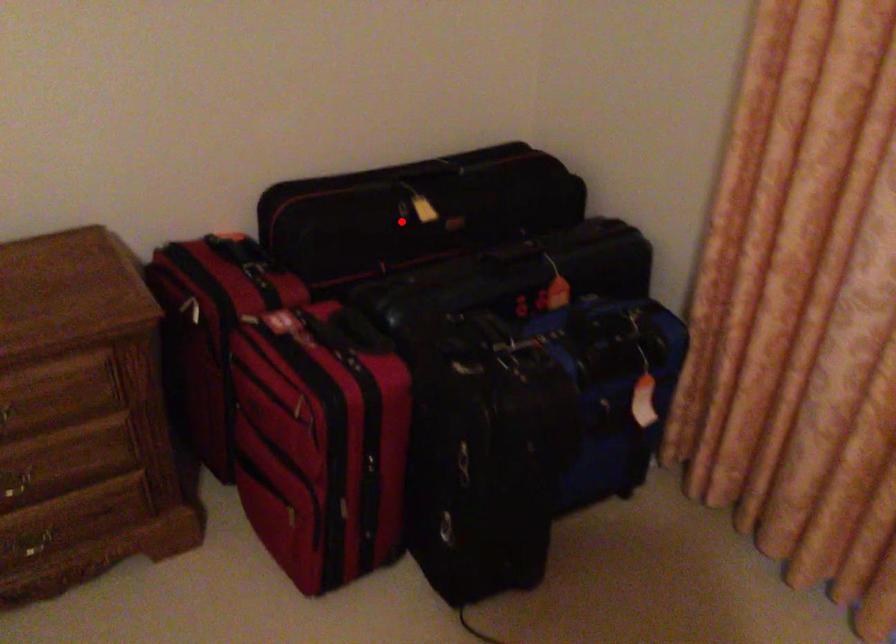
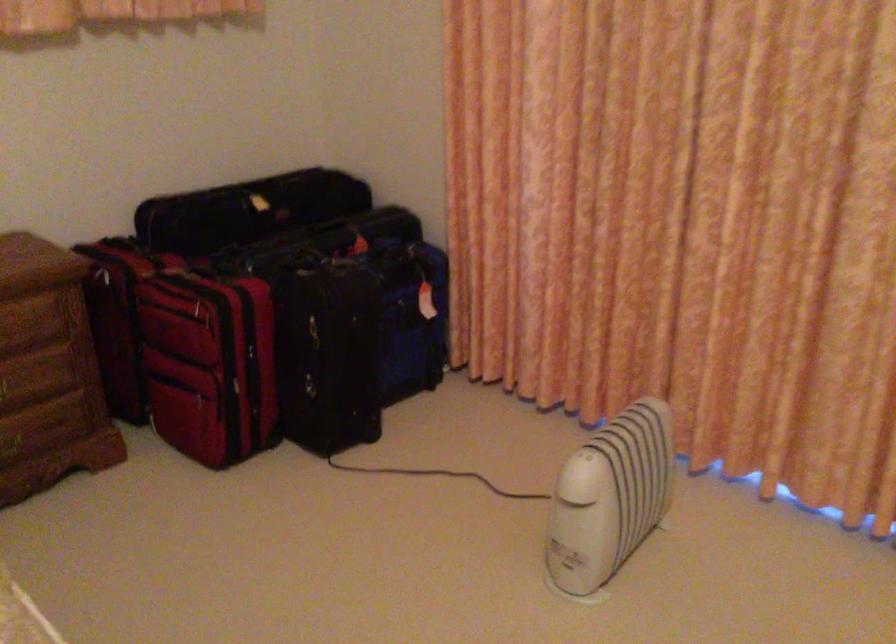
The point at the highlighted location is marked in the first image. Where is the corresponding point in the second image?

(247, 210)